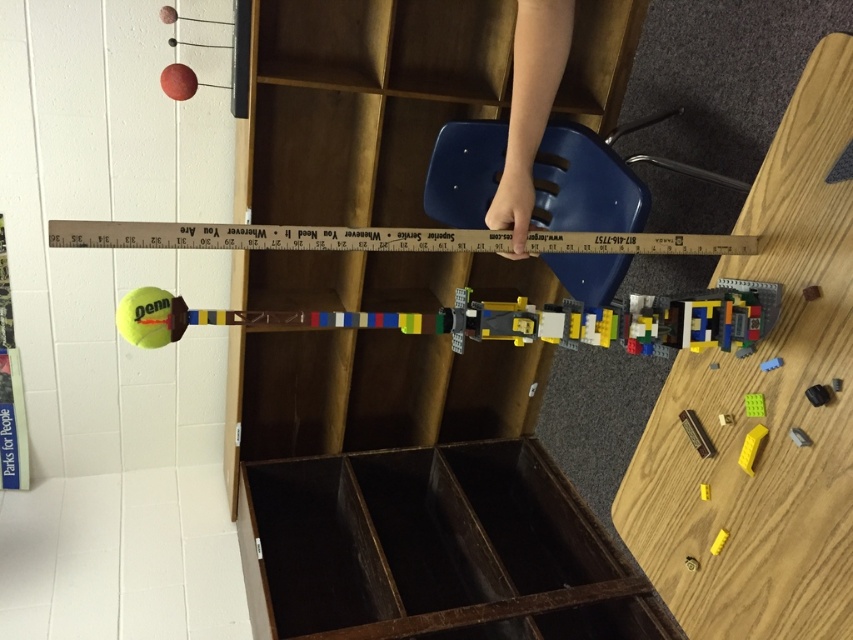
Between wooden at center and yellow matte plastic block at lower right, which one is positioned lower?

yellow matte plastic block at lower right is below.

Does point (347, 337) come farther from viewer compared to point (753, 461)?

Yes, point (347, 337) is farther from viewer.

Where is `wooden at center`? The image size is (853, 640). wooden at center is located at coordinates (361, 104).

Who is higher up, dark brown wood drawer at center or yellow rubber tennis ball at lower left?

yellow rubber tennis ball at lower left

Who is more distant from viewer, (469, 444) or (154, 314)?

The point (469, 444) is behind.

This screenshot has width=853, height=640. What do you see at coordinates (432, 548) in the screenshot?
I see `dark brown wood drawer at center` at bounding box center [432, 548].

Where is `dark brown wood drawer at center`? Image resolution: width=853 pixels, height=640 pixels. dark brown wood drawer at center is located at coordinates (432, 548).

Which is more to the left, white plastic ruler at center or yellow matte plastic block at lower right?

From the viewer's perspective, white plastic ruler at center appears more on the left side.

Between point (570, 234) and point (744, 452), which one is positioned in front?

Positioned in front is point (744, 452).

Locate an element on the screen. white plastic ruler at center is located at coordinates (271, 236).